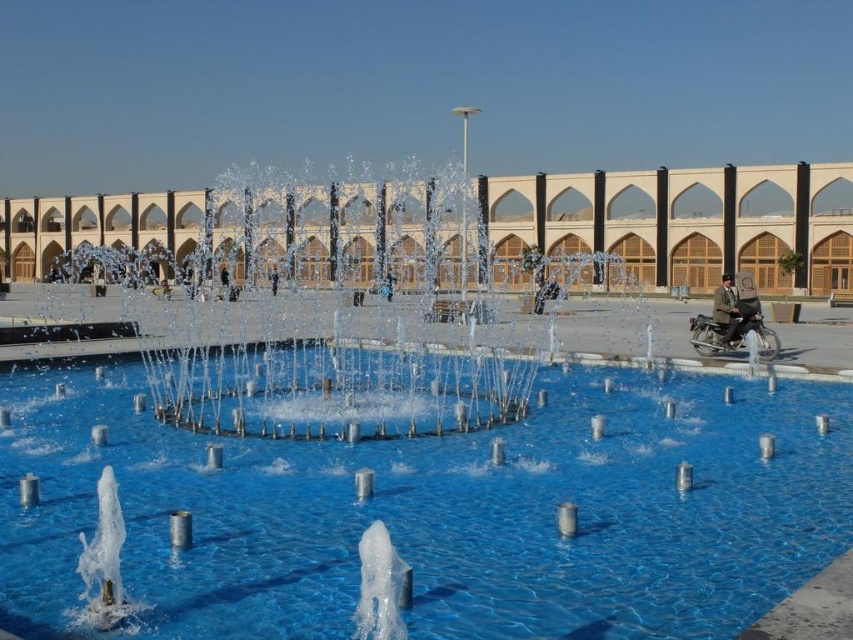
Question: Is transparent glass swimming pool at center closer to the viewer compared to dark brown leather jacket at right?

Choices:
 (A) yes
 (B) no

Answer: (A)

Question: Estimate the real-world distances between objects in this image. Which object is farther from the shiny metallic motorcycle at right?

Choices:
 (A) transparent glass swimming pool at center
 (B) dark brown leather jacket at right

Answer: (A)

Question: Is shiny metallic motorcycle at right positioned before dark brown leather jacket at right?

Choices:
 (A) yes
 (B) no

Answer: (A)

Question: Which is nearer to the transparent glass swimming pool at center?

Choices:
 (A) dark brown leather jacket at right
 (B) shiny metallic motorcycle at right

Answer: (B)

Question: Can you confirm if transparent glass swimming pool at center is positioned to the right of dark brown leather jacket at right?

Choices:
 (A) no
 (B) yes

Answer: (A)

Question: Estimate the real-world distances between objects in this image. Which object is closer to the shiny metallic motorcycle at right?

Choices:
 (A) dark brown leather jacket at right
 (B) transparent glass swimming pool at center

Answer: (A)